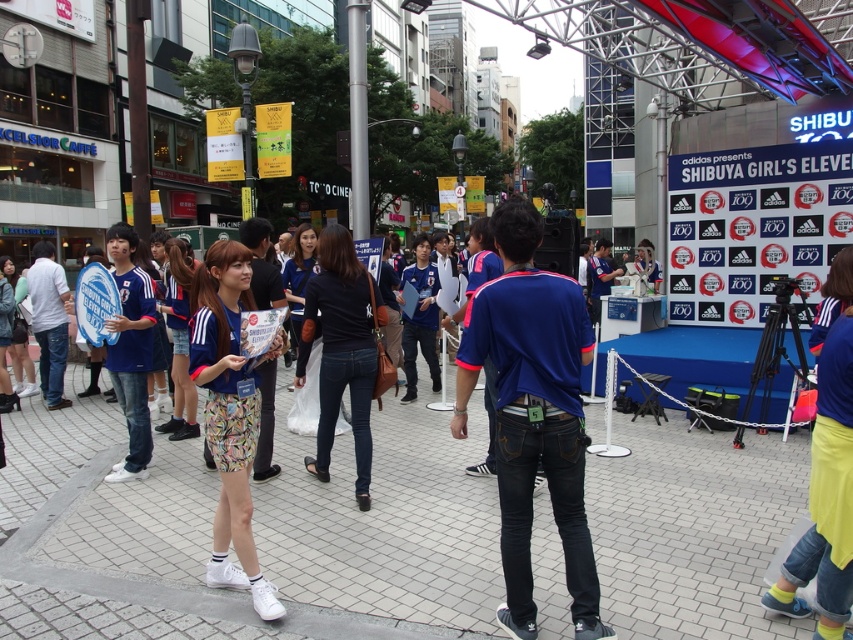
Looking at this image, you are a photographer trying to capture the Shibuya Girl in the center of the scene. You notice that the blue denim jeans at center are exactly at point (532, 413). If you want to focus on the jeans, which point should you aim your camera at?

The blue denim jeans at center are located exactly at point (532, 413), so you should aim your camera at that point to focus on them.

You are a photographer trying to capture a clear shot of the white tile pavement at center and the dark blue denim jeans at center in the Shibuya street scene. Based on their positions, which object is closer to the camera?

The white tile pavement at center is shorter than dark blue denim jeans at center, so the white tile pavement at center is closer to the camera.

You are a street performer planning to set up a small stage in the middle of the scene. The stage requires a flat surface that is larger than the dark blue denim jeans at center. Is the white tile pavement at center suitable for your stage? Please explain your reasoning.

The white tile pavement at center has a smaller size compared to the dark blue denim jeans at center. Since the stage requires a surface larger than the jeans, the pavement is not suitable because it is smaller in size.